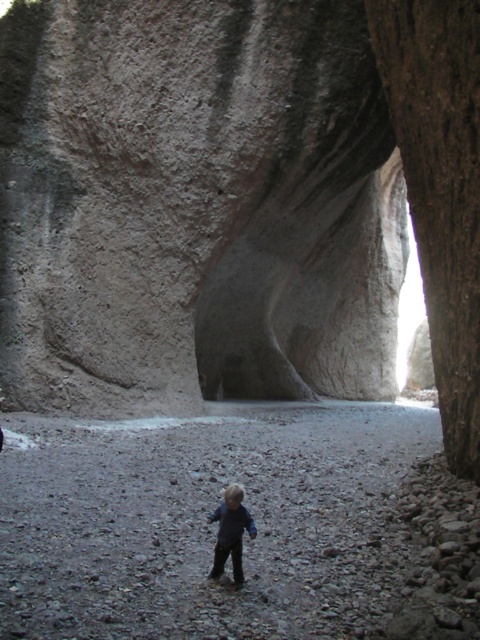
Question: Which point appears closest to the camera in this image?

Choices:
 (A) (228, 550)
 (B) (211, 212)

Answer: (A)

Question: Observing the image, what is the correct spatial positioning of gray rough rock face at center in reference to dark blue jeans at center?

Choices:
 (A) above
 (B) below

Answer: (A)

Question: Can you confirm if gray rough rock face at center is positioned above dark blue jeans at center?

Choices:
 (A) yes
 (B) no

Answer: (A)

Question: Can you confirm if gray rough rock face at center is positioned below dark blue jeans at center?

Choices:
 (A) yes
 (B) no

Answer: (B)